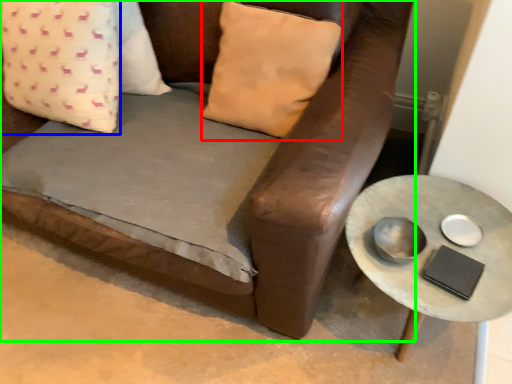
Question: Considering the real-world distances, which object is farthest from pillow (highlighted by a red box)? pillow (highlighted by a blue box) or studio couch (highlighted by a green box)?

Choices:
 (A) pillow
 (B) studio couch

Answer: (A)